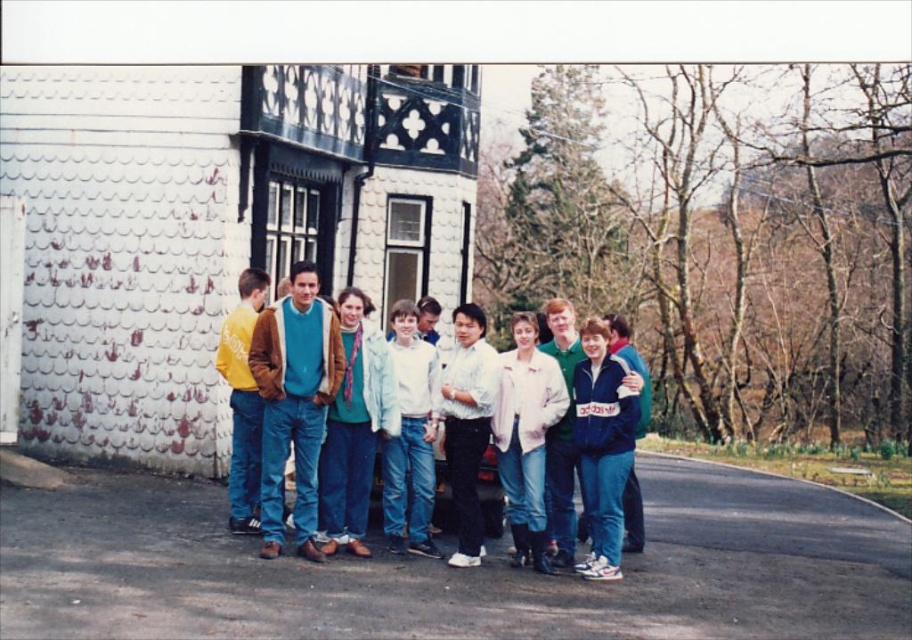
Who is taller, yellow matte jacket at left or green matte shirt at center?

With more height is yellow matte jacket at left.

Can you confirm if yellow matte jacket at left is positioned to the right of green matte shirt at center?

Incorrect, yellow matte jacket at left is not on the right side of green matte shirt at center.

Who is more forward, (254, 410) or (568, 316)?

Point (568, 316)

Find the location of a particular element. Image resolution: width=912 pixels, height=640 pixels. yellow matte jacket at left is located at coordinates (242, 401).

Does matte blue jeans at center have a greater width compared to yellow matte jacket at left?

Correct, the width of matte blue jeans at center exceeds that of yellow matte jacket at left.

Can you confirm if matte blue jeans at center is positioned above yellow matte jacket at left?

Incorrect, matte blue jeans at center is not positioned above yellow matte jacket at left.

Is point (347, 426) closer to viewer compared to point (254, 493)?

Yes, it is.

Image resolution: width=912 pixels, height=640 pixels. I want to click on matte blue jeans at center, so click(355, 426).

Is light pink fabric jacket at center below white matte shirt at center?

Indeed, light pink fabric jacket at center is positioned under white matte shirt at center.

Based on the photo, is light pink fabric jacket at center to the right of white matte shirt at center from the viewer's perspective?

Indeed, light pink fabric jacket at center is positioned on the right side of white matte shirt at center.

Identify the location of light pink fabric jacket at center. (526, 436).